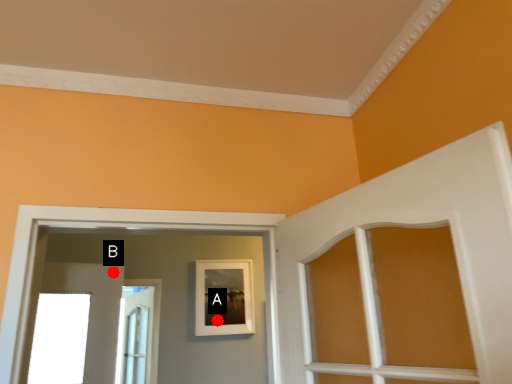
Question: Two points are circled on the image, labeled by A and B beside each circle. Which point is further to the camera?

Choices:
 (A) A is further
 (B) B is further

Answer: (A)